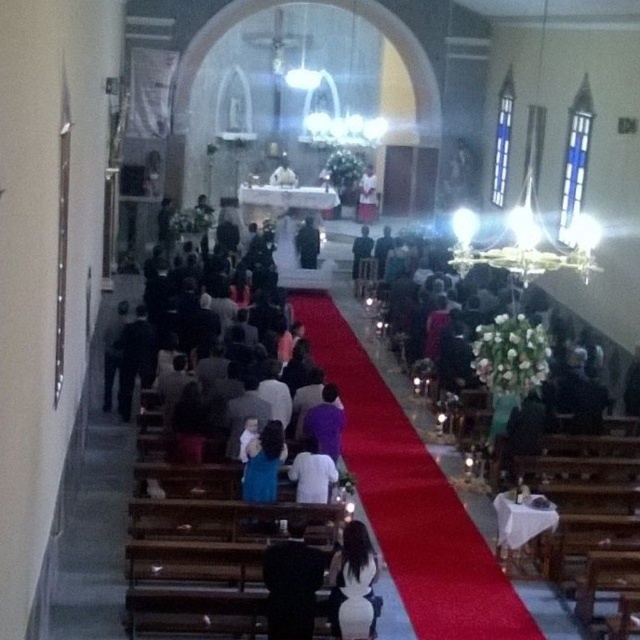
Question: Considering the real-world distances, which object is closest to the white cloth at center?

Choices:
 (A) black fabric at lower center
 (B) white matte shirt at center
 (C) black velvet suit at center

Answer: (C)

Question: Does black fabric at lower center have a smaller size compared to white cloth at center?

Choices:
 (A) no
 (B) yes

Answer: (B)

Question: Is black fabric at lower center in front of white matte shirt at center?

Choices:
 (A) no
 (B) yes

Answer: (B)

Question: Does white matte shirt at center have a smaller size compared to white cloth at center?

Choices:
 (A) no
 (B) yes

Answer: (B)

Question: Which of the following is the farthest from the observer?

Choices:
 (A) (308, 499)
 (B) (173, 528)
 (C) (314, 234)
 (D) (298, 595)

Answer: (C)

Question: Which object is positioned farthest from the white satin dress at center?

Choices:
 (A) purple fabric dress at center
 (B) white matte shirt at center

Answer: (B)